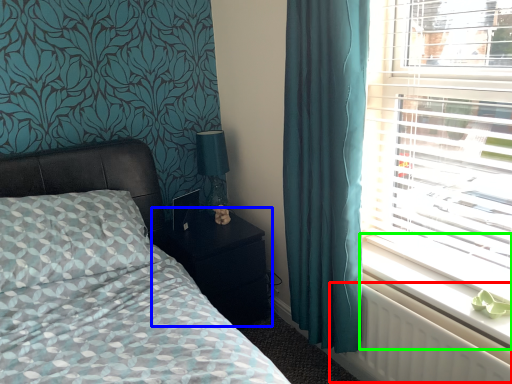
Question: Estimate the real-world distances between objects in this image. Which object is farther from radiator (highlighted by a red box), nightstand (highlighted by a blue box) or window sill (highlighted by a green box)?

Choices:
 (A) nightstand
 (B) window sill

Answer: (A)